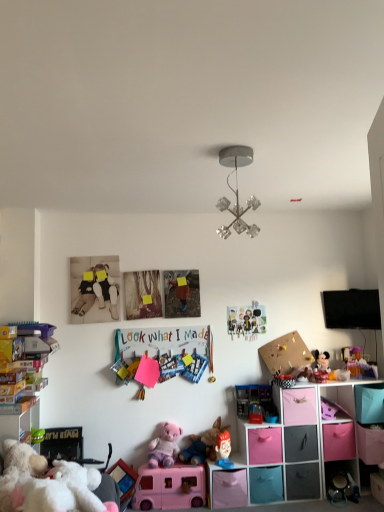
Question: Can you confirm if matte paper collage at center, placed as the seventh toy when sorted from left to right, is wider than gray matte drawer at lower right, the 3th drawer positioned from the right?

Choices:
 (A) no
 (B) yes

Answer: (A)

Question: Is matte paper collage at center, placed as the seventh toy when sorted from left to right, placed right next to gray matte drawer at lower right, the fourth drawer positioned from the left?

Choices:
 (A) yes
 (B) no

Answer: (B)

Question: Does matte paper collage at center, placed as the seventh toy when sorted from left to right, have a lesser width compared to gray matte drawer at lower right, the 3th drawer positioned from the right?

Choices:
 (A) yes
 (B) no

Answer: (A)

Question: Is matte paper collage at center, placed as the seventh toy when sorted from left to right, positioned in front of gray matte drawer at lower right, the 3th drawer positioned from the right?

Choices:
 (A) no
 (B) yes

Answer: (A)

Question: Is matte paper collage at center, placed as the seventh toy when sorted from left to right, outside of gray matte drawer at lower right, the fourth drawer positioned from the left?

Choices:
 (A) yes
 (B) no

Answer: (A)

Question: From the image's perspective, relative to pink fabric storage cubes at lower right, is teal fabric drawer at lower right, which is counted as the third drawer, starting from the left, above or below?

Choices:
 (A) below
 (B) above

Answer: (A)

Question: Considering the relative positions of teal fabric drawer at lower right, which is counted as the third drawer, starting from the left, and pink fabric storage cubes at lower right in the image provided, is teal fabric drawer at lower right, which is counted as the third drawer, starting from the left, to the left or to the right of pink fabric storage cubes at lower right?

Choices:
 (A) right
 (B) left

Answer: (B)

Question: In terms of size, does teal fabric drawer at lower right, which is counted as the third drawer, starting from the left, appear bigger or smaller than pink fabric storage cubes at lower right?

Choices:
 (A) small
 (B) big

Answer: (A)

Question: Is teal fabric drawer at lower right, which is the fourth drawer in right-to-left order, taller or shorter than pink fabric storage cubes at lower right?

Choices:
 (A) tall
 (B) short

Answer: (B)

Question: From the image's perspective, relative to translucent plastic toy at right, which is counted as the 1th toy, starting from the right, is matte paper collage at center, placed as the seventh toy when sorted from left to right, above or below?

Choices:
 (A) above
 (B) below

Answer: (A)

Question: In terms of height, does matte paper collage at center, placed as the seventh toy when sorted from left to right, look taller or shorter compared to translucent plastic toy at right, the tenth toy in the left-to-right sequence?

Choices:
 (A) short
 (B) tall

Answer: (B)

Question: Considering the positions of matte paper collage at center, placed as the seventh toy when sorted from left to right, and translucent plastic toy at right, which is counted as the 1th toy, starting from the right, in the image, is matte paper collage at center, placed as the seventh toy when sorted from left to right, bigger or smaller than translucent plastic toy at right, which is counted as the 1th toy, starting from the right,?

Choices:
 (A) big
 (B) small

Answer: (B)

Question: Considering the positions of matte paper collage at center, the 4th toy viewed from the right, and translucent plastic toy at right, the tenth toy in the left-to-right sequence, in the image, is matte paper collage at center, the 4th toy viewed from the right, wider or thinner than translucent plastic toy at right, the tenth toy in the left-to-right sequence,?

Choices:
 (A) thin
 (B) wide

Answer: (A)

Question: From the image's perspective, relative to teal fabric drawer at lower right, which is counted as the third drawer, starting from the left, is pink fabric storage cube at lower right above or below?

Choices:
 (A) above
 (B) below

Answer: (A)

Question: Visually, is pink fabric storage cube at lower right positioned to the left or to the right of teal fabric drawer at lower right, which is the fourth drawer in right-to-left order?

Choices:
 (A) right
 (B) left

Answer: (A)